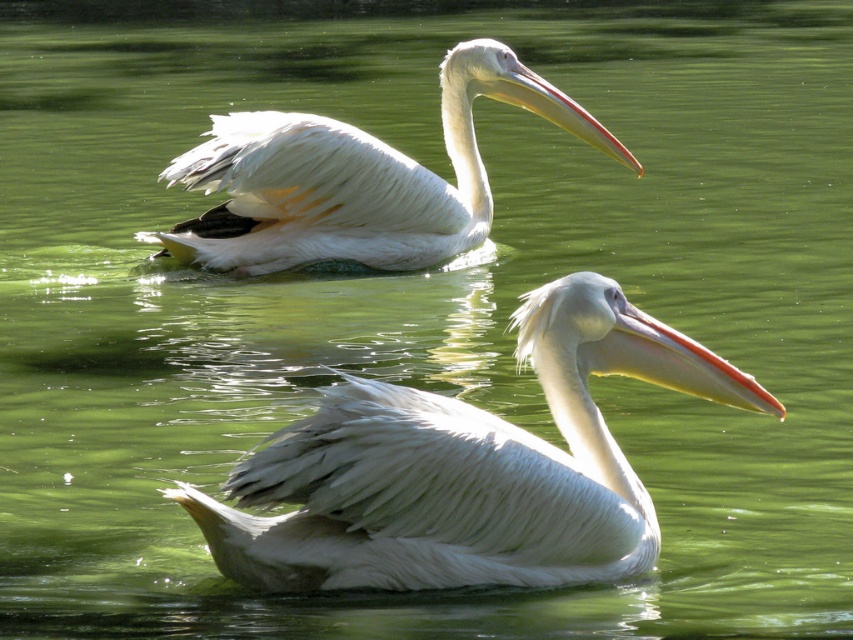
Question: Can you confirm if white feathered pelican at center is positioned above white matte beak at center?

Choices:
 (A) yes
 (B) no

Answer: (B)

Question: Among these points, which one is nearest to the camera?

Choices:
 (A) (549, 100)
 (B) (351, 205)

Answer: (A)

Question: Estimate the real-world distances between objects in this image. Which object is farther from the white matte beak at center?

Choices:
 (A) white feathered pelican at upper center
 (B) white feathered pelican at center
 (C) matte white beak at upper center

Answer: (A)

Question: From the image, what is the correct spatial relationship of white feathered pelican at center in relation to white feathered pelican at upper center?

Choices:
 (A) left
 (B) right

Answer: (B)

Question: Where is white feathered pelican at upper center located in relation to matte white beak at upper center in the image?

Choices:
 (A) above
 (B) below

Answer: (B)

Question: Which object is farther from the camera taking this photo?

Choices:
 (A) white feathered pelican at upper center
 (B) white feathered pelican at center

Answer: (A)